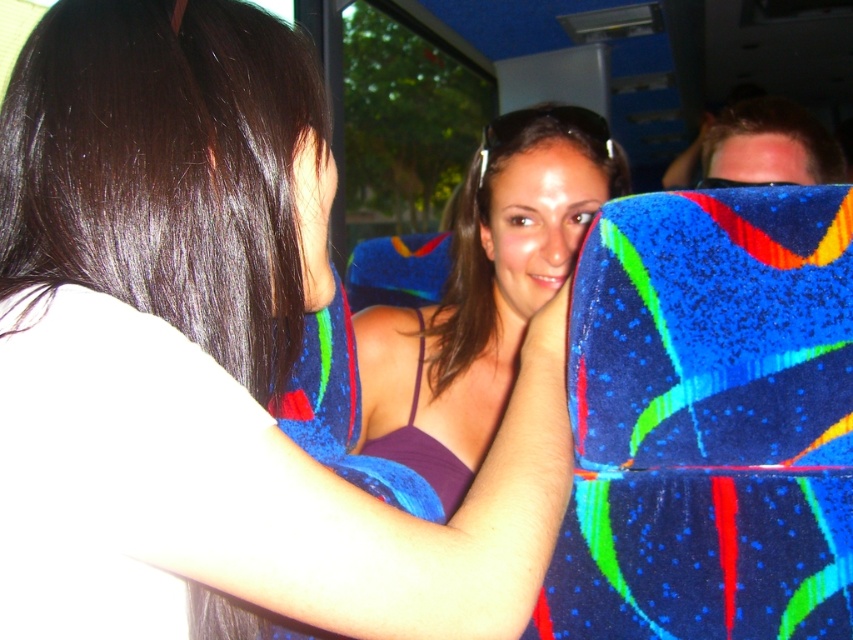
Based on the photo, can you confirm if purple fabric at center is smaller than blue textured fabric at right?

No, purple fabric at center is not smaller than blue textured fabric at right.

Is purple fabric at center in front of blue textured fabric at right?

Yes, purple fabric at center is in front of blue textured fabric at right.

Identify the location of purple fabric at center. (225, 337).

Who is higher up, blue textured fabric at right or shiny dark brown hair at upper left?

shiny dark brown hair at upper left

Which is more to the right, blue textured fabric at right or shiny dark brown hair at upper left?

From the viewer's perspective, blue textured fabric at right appears more on the right side.

Describe the element at coordinates (709, 420) in the screenshot. The image size is (853, 640). I see `blue textured fabric at right` at that location.

What are the coordinates of `blue textured fabric at right` in the screenshot? It's located at (709, 420).

Describe the element at coordinates (225, 337) in the screenshot. The width and height of the screenshot is (853, 640). I see `purple fabric at center` at that location.

Can you confirm if purple fabric at center is wider than matte purple tank top at center?

Indeed, purple fabric at center has a greater width compared to matte purple tank top at center.

What are the coordinates of `purple fabric at center` in the screenshot? It's located at (225, 337).

Locate an element on the screen. purple fabric at center is located at coordinates (225, 337).